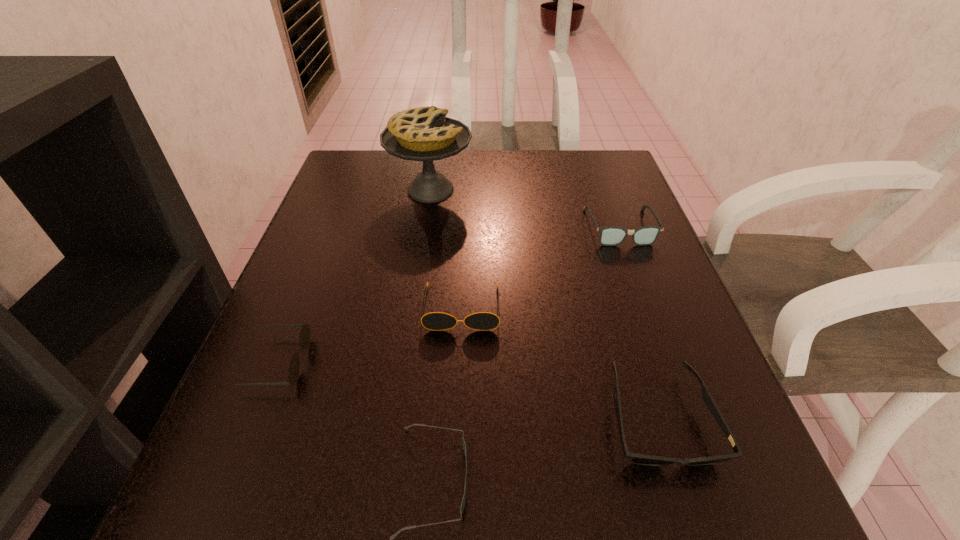
You are a GUI agent. You are given a task and a screenshot of the screen. Output one action in this format:
    pyautogui.click(x=<x>, y=<y>)
    Task: Click on the object at the far edge
    
    Given the screenshot: What is the action you would take?
    pyautogui.click(x=424, y=134)

This screenshot has width=960, height=540. Identify the location of object at the near edge. (640, 459).

Find the location of a particular element. This screenshot has height=540, width=960. pie located at the left edge is located at coordinates (424, 134).

Locate an element on the screen. sunglasses situated at the left edge is located at coordinates pos(304,339).

Where is `spectacles located at the right edge`? The height and width of the screenshot is (540, 960). spectacles located at the right edge is located at coordinates click(609, 236).

Where is `sunglasses located at the right edge`? This screenshot has height=540, width=960. sunglasses located at the right edge is located at coordinates (640, 459).

Locate an element on the screen. The width and height of the screenshot is (960, 540). object that is at the far left corner is located at coordinates (424, 134).

Where is `object at the near right corner`? The width and height of the screenshot is (960, 540). object at the near right corner is located at coordinates (640, 459).

Where is `vacant position at the far edge of the desktop`? This screenshot has height=540, width=960. vacant position at the far edge of the desktop is located at coordinates (480, 189).

The height and width of the screenshot is (540, 960). Find the location of `vacant space at the near edge of the desktop`. vacant space at the near edge of the desktop is located at coordinates click(625, 532).